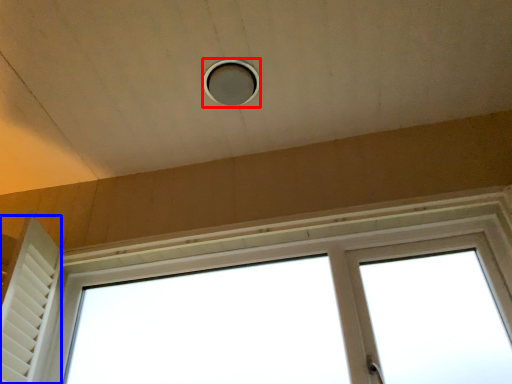
Question: Which object is further to the camera taking this photo, hole (highlighted by a red box) or shutter (highlighted by a blue box)?

Choices:
 (A) hole
 (B) shutter

Answer: (A)